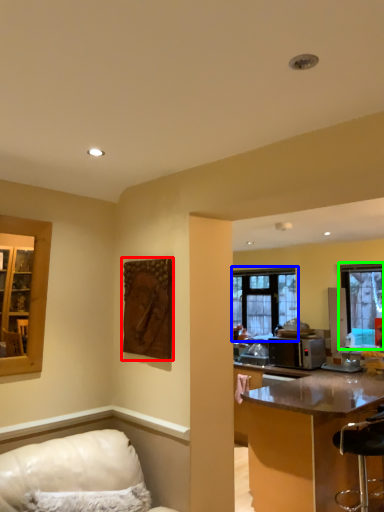
Question: Considering the real-world distances, which object is farthest from picture frame (highlighted by a red box)? window (highlighted by a blue box) or window (highlighted by a green box)?

Choices:
 (A) window
 (B) window

Answer: (A)